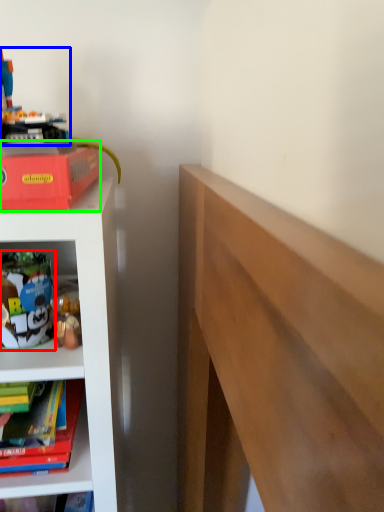
Question: Considering the real-world distances, which object is farthest from toy (highlighted by a red box)? toy (highlighted by a blue box) or paperback book (highlighted by a green box)?

Choices:
 (A) toy
 (B) paperback book

Answer: (A)